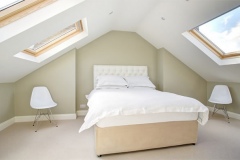
Where is `carpet`? carpet is located at coordinates (225, 132).